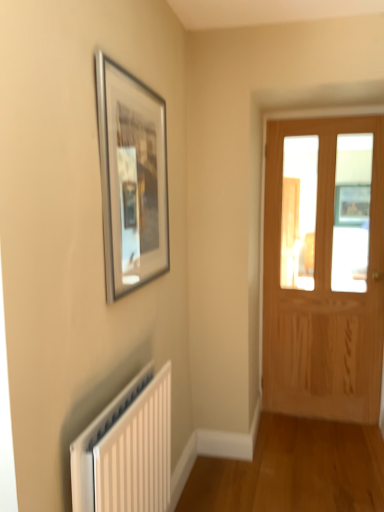
In order to click on free space that is to the left of light brown wooden door at right in this screenshot , I will do `click(285, 432)`.